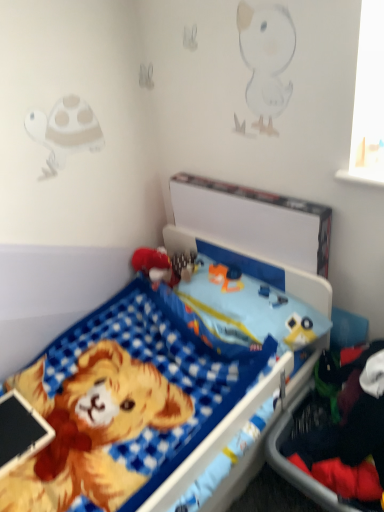
Question: Is red plush toy at center positioned with its back to blue checkered bed at center?

Choices:
 (A) yes
 (B) no

Answer: (A)

Question: Is red plush toy at center to the right of blue checkered bed at center from the viewer's perspective?

Choices:
 (A) yes
 (B) no

Answer: (B)

Question: Is the position of red plush toy at center more distant than that of blue checkered bed at center?

Choices:
 (A) no
 (B) yes

Answer: (B)

Question: Does red plush toy at center turn towards blue checkered bed at center?

Choices:
 (A) no
 (B) yes

Answer: (B)

Question: Is red plush toy at center not near blue checkered bed at center?

Choices:
 (A) yes
 (B) no

Answer: (B)

Question: From the image's perspective, is red plush toy at center above blue checkered bed at center?

Choices:
 (A) yes
 (B) no

Answer: (A)

Question: Could you tell me if blue checkered bed at center is turned towards dark blue fabric at lower right?

Choices:
 (A) yes
 (B) no

Answer: (A)

Question: Is blue checkered bed at center turned away from dark blue fabric at lower right?

Choices:
 (A) no
 (B) yes

Answer: (A)

Question: Does blue checkered bed at center have a lesser width compared to dark blue fabric at lower right?

Choices:
 (A) yes
 (B) no

Answer: (B)

Question: From the image's perspective, would you say blue checkered bed at center is shown under dark blue fabric at lower right?

Choices:
 (A) yes
 (B) no

Answer: (B)

Question: Can you confirm if blue checkered bed at center is wider than dark blue fabric at lower right?

Choices:
 (A) yes
 (B) no

Answer: (A)

Question: Are blue checkered bed at center and dark blue fabric at lower right far apart?

Choices:
 (A) no
 (B) yes

Answer: (A)

Question: Considering the relative sizes of red plush toy at center and dark blue fabric at lower right in the image provided, is red plush toy at center thinner than dark blue fabric at lower right?

Choices:
 (A) no
 (B) yes

Answer: (B)